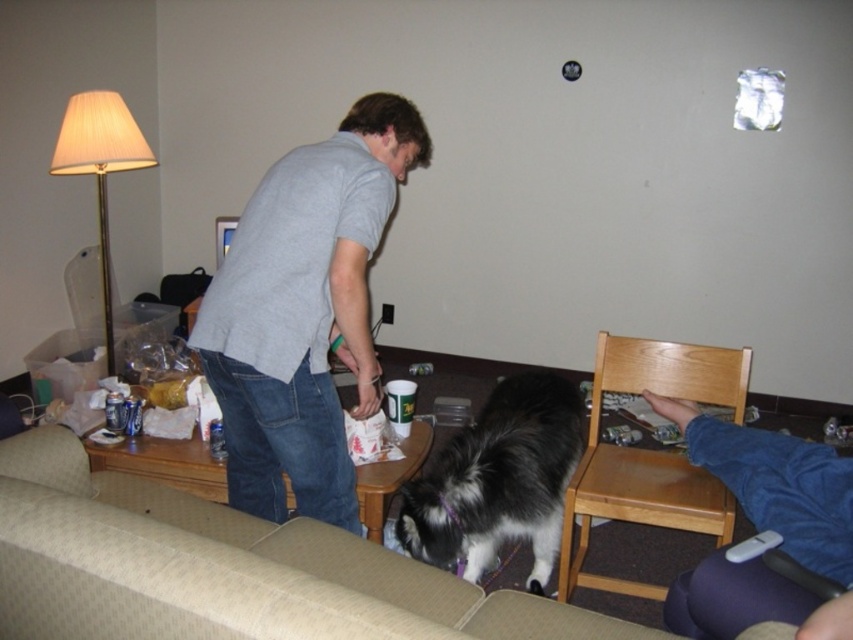
Question: Can you confirm if gray cotton shirt at center is smaller than black and white fur at center?

Choices:
 (A) yes
 (B) no

Answer: (B)

Question: Which point is closer to the camera taking this photo?

Choices:
 (A) (206, 342)
 (B) (125, 442)
 (C) (68, 435)

Answer: (A)

Question: Estimate the real-world distances between objects in this image. Which object is farther from the wooden table at center?

Choices:
 (A) beige fabric couch at lower left
 (B) gray cotton shirt at center

Answer: (B)

Question: Among these objects, which one is nearest to the camera?

Choices:
 (A) black and white fur at center
 (B) wooden table at center

Answer: (B)

Question: Does beige fabric couch at lower left appear over wooden table at center?

Choices:
 (A) no
 (B) yes

Answer: (A)

Question: Is the position of gray cotton shirt at center less distant than that of wooden table at center?

Choices:
 (A) no
 (B) yes

Answer: (B)